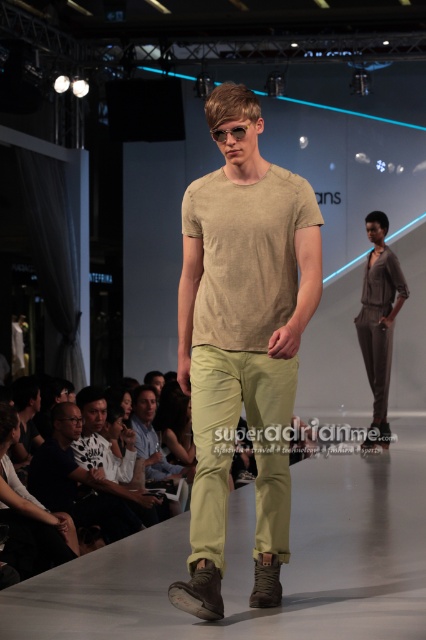
You are a photographer at the fashion show. You need to capture a photo where both the matte black shirt at center and the clear plastic goggles at center are visible. Based on their positions, which object should you adjust your camera focus to first to ensure both are in the frame?

The matte black shirt at center is to the left of clear plastic goggles at center. To ensure both are in the frame, focus on the matte black shirt at center first since it is positioned to the left, allowing the camera to capture the entire area from left to right.

You are a fashion designer observing the runway. You need to determine the spatial relationship between the matte black shirt at center and the matte gray jumpsuit at center. Which one is located lower in the image?

The matte black shirt at center is positioned under the matte gray jumpsuit at center, so the matte black shirt at center is located lower in the image.